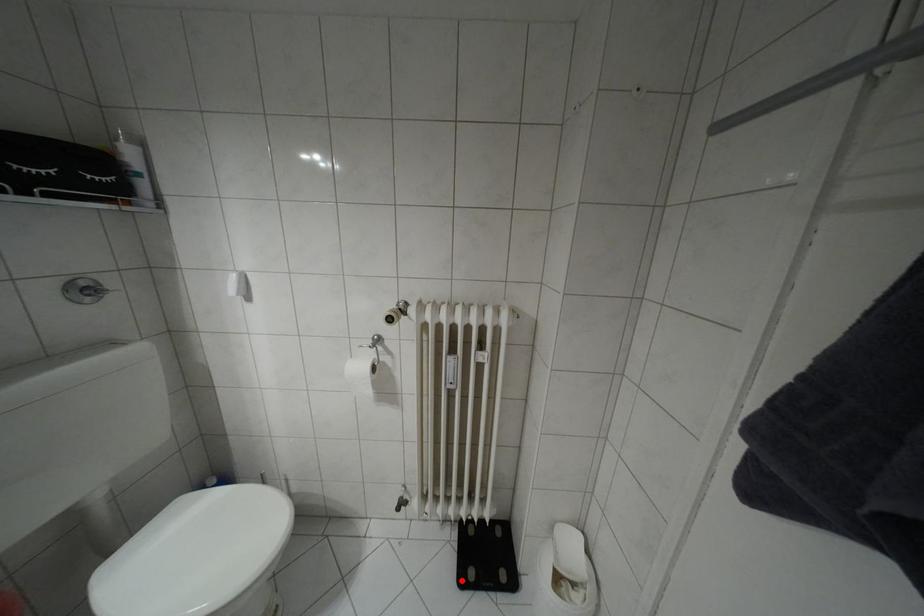
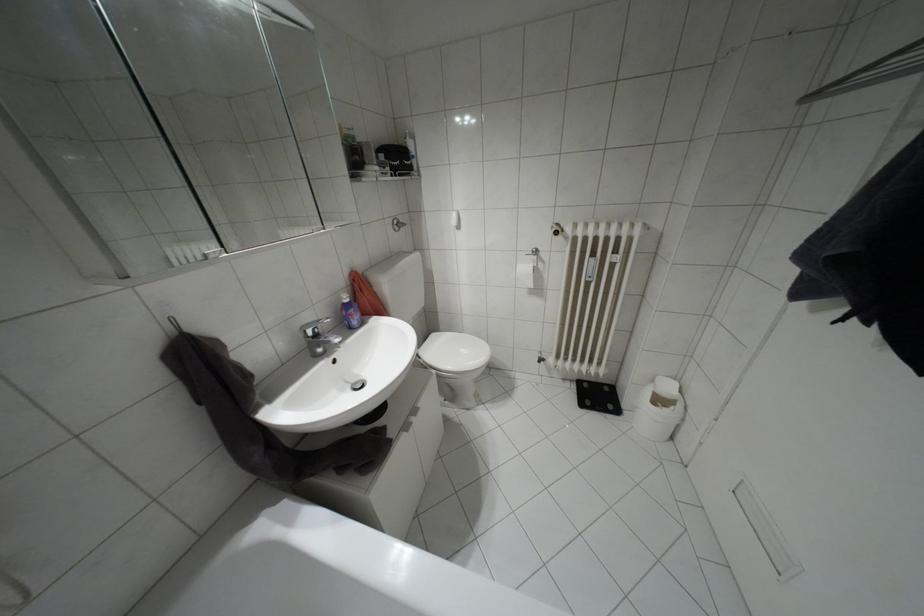
Find the pixel in the second image that matches the highlighted location in the first image.

(580, 405)